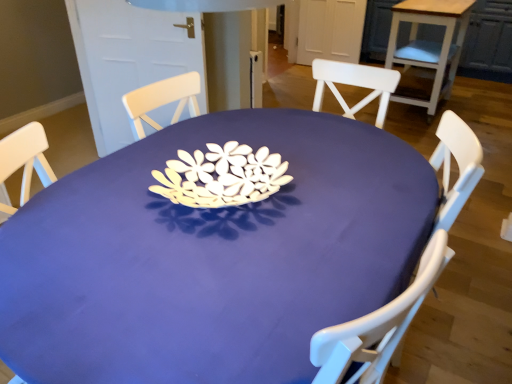
The height and width of the screenshot is (384, 512). What do you see at coordinates (211, 256) in the screenshot?
I see `matte purple table at center, the 2th table positioned from the back` at bounding box center [211, 256].

How much space does matte purple table at center, arranged as the 1th table when ordered from the bottom, occupy vertically?

The height of matte purple table at center, arranged as the 1th table when ordered from the bottom, is 33.41 inches.

Find the location of a particular element. The width and height of the screenshot is (512, 384). matte purple table at center, the 2th table when ordered from right to left is located at coordinates (211, 256).

What is the approximate width of wooden table at upper right, placed as the 1th table when sorted from right to left?

wooden table at upper right, placed as the 1th table when sorted from right to left, is 20.93 inches in width.

Measure the distance between wooden table at upper right, which appears as the first table when viewed from the top, and camera.

A distance of 10.66 feet exists between wooden table at upper right, which appears as the first table when viewed from the top, and camera.

The height and width of the screenshot is (384, 512). Describe the element at coordinates (429, 43) in the screenshot. I see `wooden table at upper right, which appears as the first table when viewed from the top` at that location.

Identify the location of wooden table at upper right, which appears as the first table when viewed from the top. This screenshot has width=512, height=384. (429, 43).

This screenshot has width=512, height=384. I want to click on matte purple table at center, the 2th table positioned from the back, so (x=211, y=256).

Is wooden table at upper right, which appears as the first table when viewed from the top, at the right side of matte purple table at center, acting as the 1th table starting from the left?

Indeed, wooden table at upper right, which appears as the first table when viewed from the top, is positioned on the right side of matte purple table at center, acting as the 1th table starting from the left.

Is wooden table at upper right, which appears as the first table when viewed from the top, in front of or behind matte purple table at center, the 2th table when ordered from right to left, in the image?

Clearly, wooden table at upper right, which appears as the first table when viewed from the top, is behind matte purple table at center, the 2th table when ordered from right to left.

Which is in front, point (402, 16) or point (96, 283)?

The point (96, 283) is more forward.

From the image's perspective, is wooden table at upper right, which appears as the first table when viewed from the top, located above or below matte purple table at center, acting as the 1th table starting from the left?

wooden table at upper right, which appears as the first table when viewed from the top, is situated higher than matte purple table at center, acting as the 1th table starting from the left, in the image.

From a real-world perspective, which object rests below the other?

matte purple table at center, the 1th table viewed from the front, from a real-world perspective.

Between wooden table at upper right, placed as the 1th table when sorted from right to left, and matte purple table at center, the 1th table viewed from the front, which one has smaller width?

With smaller width is wooden table at upper right, placed as the 1th table when sorted from right to left.

From their relative heights in the image, would you say wooden table at upper right, which appears as the first table when viewed from the top, is taller or shorter than matte purple table at center, arranged as the 1th table when ordered from the bottom?

Clearly, wooden table at upper right, which appears as the first table when viewed from the top, is taller compared to matte purple table at center, arranged as the 1th table when ordered from the bottom.

Considering the relative sizes of wooden table at upper right, which appears as the first table when viewed from the top, and matte purple table at center, acting as the 1th table starting from the left, in the image provided, is wooden table at upper right, which appears as the first table when viewed from the top, smaller than matte purple table at center, acting as the 1th table starting from the left,?

→ Correct, wooden table at upper right, which appears as the first table when viewed from the top, occupies less space than matte purple table at center, acting as the 1th table starting from the left.

Is wooden table at upper right, placed as the 1th table when sorted from right to left, surrounding matte purple table at center, the 2th table when ordered from right to left?

No.

Is wooden table at upper right, which is the 2th table in bottom-to-top order, turned away from matte purple table at center, which is the 2th table from top to bottom?

No, wooden table at upper right, which is the 2th table in bottom-to-top order,'s orientation is not away from matte purple table at center, which is the 2th table from top to bottom.

How many degrees apart are the facing directions of wooden table at upper right, arranged as the 2th table when viewed from the left, and matte purple table at center, arranged as the 1th table when ordered from the bottom?

The angle between the facing direction of wooden table at upper right, arranged as the 2th table when viewed from the left, and the facing direction of matte purple table at center, arranged as the 1th table when ordered from the bottom, is 89 degrees.

Based on the photo, could you measure the distance between wooden table at upper right, which appears as the first table when viewed from the top, and matte purple table at center, the 2th table positioned from the back?

A distance of 8.46 feet exists between wooden table at upper right, which appears as the first table when viewed from the top, and matte purple table at center, the 2th table positioned from the back.

You are a GUI agent. You are given a task and a screenshot of the screen. Output one action in this format:
    pyautogui.click(x=<x>, y=<y>)
    Task: Click on the table behind the matte purple table at center, the 1th table viewed from the front
    This screenshot has height=384, width=512.
    Given the screenshot: What is the action you would take?
    pyautogui.click(x=429, y=43)

Between matte purple table at center, acting as the 1th table starting from the left, and wooden table at upper right, arranged as the 2th table when viewed from the left, which one appears on the left side from the viewer's perspective?

matte purple table at center, acting as the 1th table starting from the left, is more to the left.

Is matte purple table at center, acting as the 1th table starting from the left, in front of or behind wooden table at upper right, arranged as the 2th table when viewed from the left, in the image?

matte purple table at center, acting as the 1th table starting from the left, is positioned closer to the viewer than wooden table at upper right, arranged as the 2th table when viewed from the left.

Which is in front, point (128, 345) or point (429, 20)?

Positioned in front is point (128, 345).

From the image's perspective, is matte purple table at center, the 2th table positioned from the back, over wooden table at upper right, arranged as the second table when viewed from the front?

Incorrect, from the image's perspective, matte purple table at center, the 2th table positioned from the back, is lower than wooden table at upper right, arranged as the second table when viewed from the front.

From a real-world perspective, which object rests below the other?

matte purple table at center, the 1th table viewed from the front, from a real-world perspective.

Which of these two, matte purple table at center, arranged as the 1th table when ordered from the bottom, or wooden table at upper right, which is counted as the first table, starting from the back, is wider?

matte purple table at center, arranged as the 1th table when ordered from the bottom.

Considering the sizes of objects matte purple table at center, which is the 2th table from top to bottom, and wooden table at upper right, placed as the 1th table when sorted from right to left, in the image provided, who is taller, matte purple table at center, which is the 2th table from top to bottom, or wooden table at upper right, placed as the 1th table when sorted from right to left,?

With more height is wooden table at upper right, placed as the 1th table when sorted from right to left.

Can you confirm if matte purple table at center, acting as the 1th table starting from the left, is bigger than wooden table at upper right, which is counted as the first table, starting from the back?

Yes, matte purple table at center, acting as the 1th table starting from the left, is bigger than wooden table at upper right, which is counted as the first table, starting from the back.

Is matte purple table at center, the 2th table when ordered from right to left, inside or outside of wooden table at upper right, arranged as the 2th table when viewed from the left?

matte purple table at center, the 2th table when ordered from right to left, is located beyond the bounds of wooden table at upper right, arranged as the 2th table when viewed from the left.

Looking at this image, is matte purple table at center, the 2th table positioned from the back, directly adjacent to wooden table at upper right, placed as the 1th table when sorted from right to left?

No.

Consider the image. Could you tell me if matte purple table at center, which is the 2th table from top to bottom, is turned towards wooden table at upper right, placed as the 1th table when sorted from right to left?

Yes, matte purple table at center, which is the 2th table from top to bottom, is turned towards wooden table at upper right, placed as the 1th table when sorted from right to left.

How different are the orientations of matte purple table at center, the 2th table when ordered from right to left, and wooden table at upper right, which is the 2th table in bottom-to-top order, in degrees?

89 degrees.

How much distance is there between matte purple table at center, the 1th table viewed from the front, and wooden table at upper right, arranged as the 2th table when viewed from the left?

matte purple table at center, the 1th table viewed from the front, and wooden table at upper right, arranged as the 2th table when viewed from the left, are 2.58 meters apart.

I want to click on table above the matte purple table at center, acting as the 1th table starting from the left (from the image's perspective), so click(429, 43).

In order to click on table below the wooden table at upper right, which is the 2th table in bottom-to-top order (from the image's perspective) in this screenshot , I will do `click(211, 256)`.

Where is `table above the matte purple table at center, acting as the 1th table starting from the left (from a real-world perspective)`? This screenshot has height=384, width=512. table above the matte purple table at center, acting as the 1th table starting from the left (from a real-world perspective) is located at coordinates (429, 43).